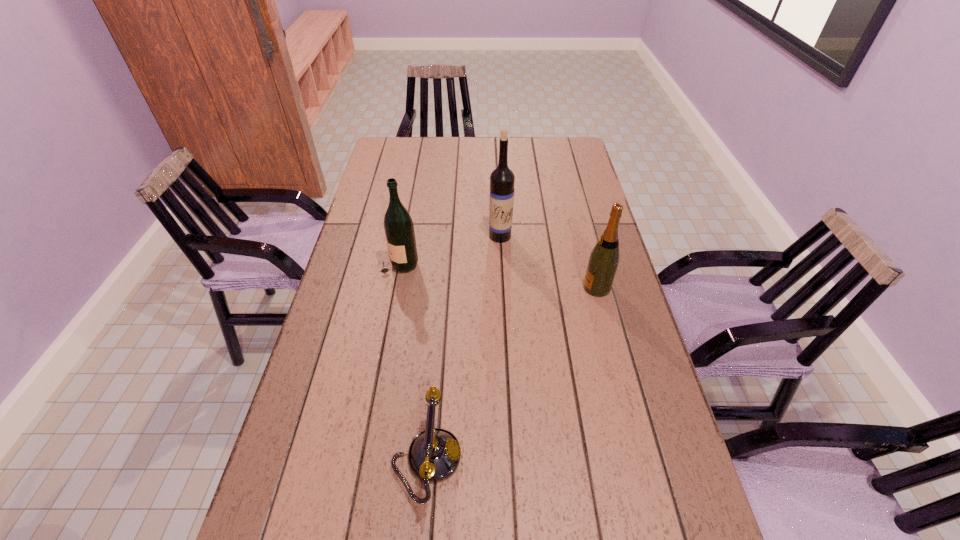
Locate an element on the screen. This screenshot has width=960, height=540. the tallest object is located at coordinates (502, 179).

Locate an element on the screen. This screenshot has height=540, width=960. the second wine bottle from right to left is located at coordinates (502, 179).

Locate an element on the screen. the second farthest wine bottle is located at coordinates (399, 229).

Where is `the leftmost object`? The height and width of the screenshot is (540, 960). the leftmost object is located at coordinates (399, 229).

Where is `the third farthest object`? The image size is (960, 540). the third farthest object is located at coordinates (603, 262).

This screenshot has width=960, height=540. Find the location of `the nearest wine bottle`. the nearest wine bottle is located at coordinates (603, 262).

Identify the location of the shortest object. Image resolution: width=960 pixels, height=540 pixels. (434, 455).

Where is `telephone`? This screenshot has width=960, height=540. telephone is located at coordinates (434, 455).

Locate an element on the screen. This screenshot has width=960, height=540. free region located on the label of the third object from left to right is located at coordinates (505, 335).

The image size is (960, 540). Identify the location of free point located 0.200m on the right of the second farthest wine bottle. (484, 263).